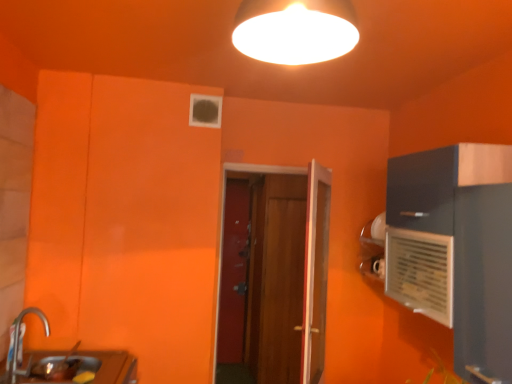
Question: Can you confirm if brushed metal faucet at lower left is taller than wooden door at center, arranged as the first door when viewed from the front?

Choices:
 (A) no
 (B) yes

Answer: (A)

Question: Is wooden door at center, arranged as the first door when viewed from the front, a part of brushed metal faucet at lower left?

Choices:
 (A) yes
 (B) no

Answer: (B)

Question: Is brushed metal faucet at lower left far from wooden door at center, placed as the 3th door when sorted from back to front?

Choices:
 (A) yes
 (B) no

Answer: (A)

Question: Are brushed metal faucet at lower left and wooden door at center, placed as the 3th door when sorted from back to front, beside each other?

Choices:
 (A) no
 (B) yes

Answer: (A)

Question: Can you confirm if brushed metal faucet at lower left is positioned to the left of wooden door at center, arranged as the first door when viewed from the front?

Choices:
 (A) yes
 (B) no

Answer: (A)

Question: Considering the positions of wooden door at center, placed as the 3th door when sorted from back to front, and smooth wooden door at center, placed as the 1th door when sorted from back to front, in the image, is wooden door at center, placed as the 3th door when sorted from back to front, wider or thinner than smooth wooden door at center, placed as the 1th door when sorted from back to front,?

Choices:
 (A) wide
 (B) thin

Answer: (A)

Question: Based on their positions, is wooden door at center, arranged as the first door when viewed from the front, located to the left or right of smooth wooden door at center, placed as the 1th door when sorted from back to front?

Choices:
 (A) left
 (B) right

Answer: (B)

Question: In terms of size, does wooden door at center, arranged as the first door when viewed from the front, appear bigger or smaller than smooth wooden door at center, which is the 3th door from front to back?

Choices:
 (A) small
 (B) big

Answer: (B)

Question: Relative to smooth wooden door at center, placed as the 1th door when sorted from back to front, is wooden door at center, placed as the 3th door when sorted from back to front, in front or behind?

Choices:
 (A) behind
 (B) front

Answer: (B)

Question: Is wooden door at center, placed as the 3th door when sorted from back to front, to the left or to the right of white plastic air conditioner at right in the image?

Choices:
 (A) left
 (B) right

Answer: (A)

Question: Do you think wooden door at center, arranged as the first door when viewed from the front, is within white plastic air conditioner at right, or outside of it?

Choices:
 (A) inside
 (B) outside

Answer: (B)

Question: In the image, is wooden door at center, arranged as the first door when viewed from the front, positioned in front of or behind white plastic air conditioner at right?

Choices:
 (A) behind
 (B) front

Answer: (A)

Question: From a real-world perspective, is wooden door at center, placed as the 3th door when sorted from back to front, positioned above or below white plastic air conditioner at right?

Choices:
 (A) below
 (B) above

Answer: (A)

Question: Is brushed metal faucet at lower left in front of or behind smooth wooden door at center, which is the 3th door from front to back, in the image?

Choices:
 (A) front
 (B) behind

Answer: (A)

Question: From a real-world perspective, relative to smooth wooden door at center, placed as the 1th door when sorted from back to front, is brushed metal faucet at lower left vertically above or below?

Choices:
 (A) below
 (B) above

Answer: (B)